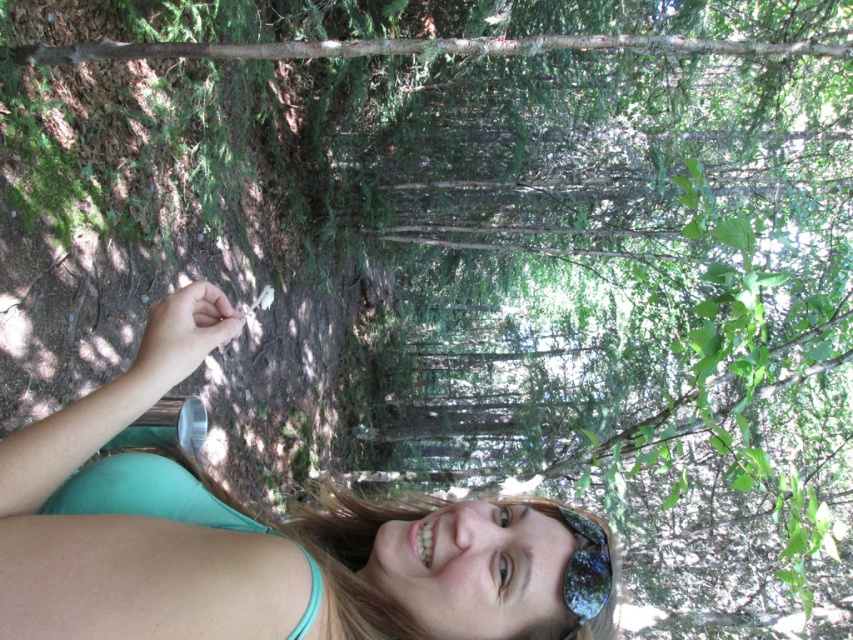
You are a photographer trying to capture a closeup of the shiny reflective sunglasses at lower center. You want to ensure the green fabric shirt at lower left doesn

The green fabric shirt at lower left is much taller than the shiny reflective sunglasses at lower center, so you should adjust your camera angle to lower your viewpoint so the green fabric shirt at lower left doesn

You are trying to decide which clothing item to take with you on a hike. You see the green fabric shirt at lower left and the teal fabric bikini top at lower left in the image. Which clothing item is taller?

The green fabric shirt at lower left is much taller than the teal fabric bikini top at lower left, so the green fabric shirt at lower left is taller.

You are a photographer trying to capture a detailed shot of the two points in the image. Which point, point (218, 564) or point (587, 580), should you focus on first to ensure it appears sharp in the photo?

Point (218, 564) should be focused on first because it is closer to the camera than point (587, 580), making it easier to capture sharply.